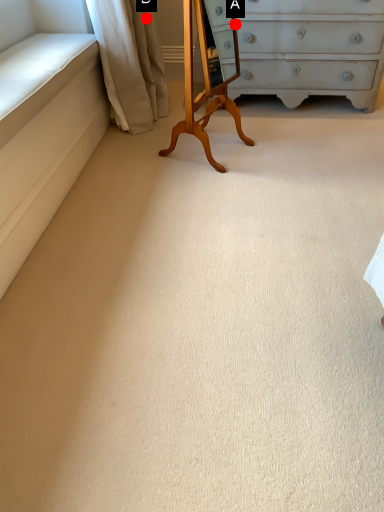
Question: Two points are circled on the image, labeled by A and B beside each circle. Which point is farther from the camera taking this photo?

Choices:
 (A) A is further
 (B) B is further

Answer: (B)